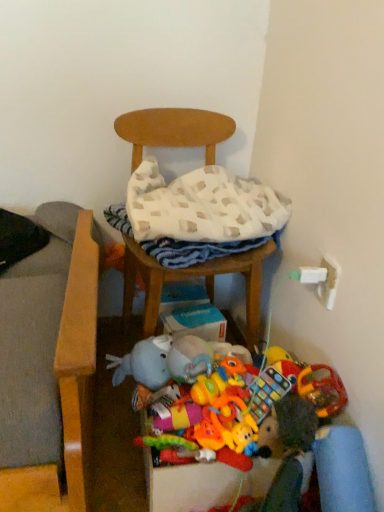
Question: Is rubberized plastic toy at lower center, which ranks as the 1th toy in right-to-left order, to the left or to the right of knitted fabric rattle at center, which is counted as the second toy, starting from the right, in the image?

Choices:
 (A) right
 (B) left

Answer: (A)

Question: Considering the positions of rubberized plastic toy at lower center, which ranks as the 1th toy in right-to-left order, and knitted fabric rattle at center, which is the first toy in left-to-right order, in the image, is rubberized plastic toy at lower center, which ranks as the 1th toy in right-to-left order, wider or thinner than knitted fabric rattle at center, which is the first toy in left-to-right order,?

Choices:
 (A) wide
 (B) thin

Answer: (A)

Question: Considering the real-world distances, which object is farthest from the wooden chair at center?

Choices:
 (A) rubberized plastic toy at lower center, which ranks as the 1th toy in right-to-left order
 (B) knitted fabric rattle at center, which is counted as the second toy, starting from the right
 (C) white woven blanket at center

Answer: (B)

Question: Which of these objects is positioned farthest from the white woven blanket at center?

Choices:
 (A) wooden chair at center
 (B) rubberized plastic toy at lower center, which ranks as the 1th toy in right-to-left order
 (C) knitted fabric rattle at center, which is the first toy in left-to-right order

Answer: (C)